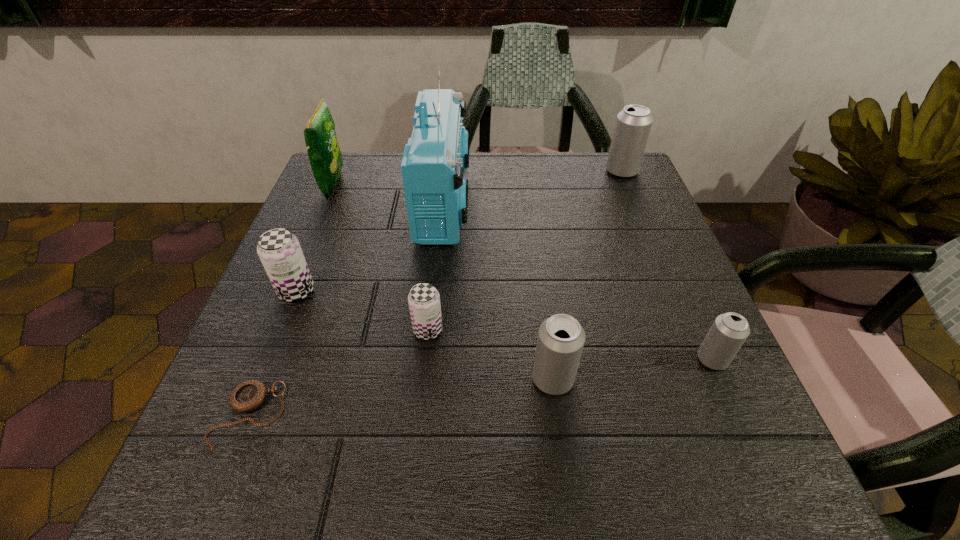
You are a GUI agent. You are given a task and a screenshot of the screen. Output one action in this format:
    pyautogui.click(x=<x>, y=<y>)
    Task: Click on the object positioned at the far right corner
    This screenshot has width=960, height=540.
    Given the screenshot: What is the action you would take?
    pyautogui.click(x=633, y=124)

Identify the location of vacant region at the far edge of the desktop. The image size is (960, 540). (496, 157).

Identify the location of vacant area at the near edge. (482, 462).

Identify the location of vacant space at the left edge of the desktop. The image size is (960, 540). tap(365, 216).

The image size is (960, 540). In the image, there is a desktop. Find the location of `blank space at the right edge`. blank space at the right edge is located at coordinates pos(675,380).

At what (x,y) coordinates should I click in order to perform the action: click on free space at the far left corner. Please return your answer as a coordinate pair (x, y). The image size is (960, 540). Looking at the image, I should click on (344, 176).

This screenshot has height=540, width=960. Identify the location of blank area at the far right corner. click(x=624, y=188).

The width and height of the screenshot is (960, 540). I want to click on vacant space at the near right corner of the desktop, so click(x=727, y=494).

Locate an element on the screen. vacant space in between the crisp (potato chip) and the bigger purple beer can is located at coordinates (315, 238).

This screenshot has width=960, height=540. I want to click on empty location between the right purple beer can and the tallest object, so click(436, 266).